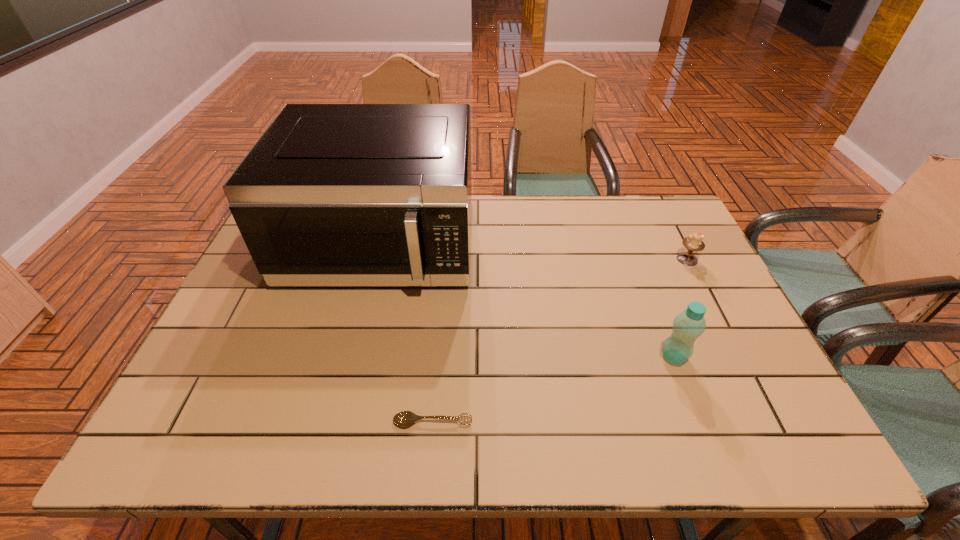
Find the location of a particular element. The image size is (960, 540). microwave_oven is located at coordinates (331, 194).

I want to click on the second nearest object, so pyautogui.click(x=688, y=325).

This screenshot has height=540, width=960. I want to click on the second tallest object, so click(x=688, y=325).

Find the location of a particular element. candle holder is located at coordinates (693, 242).

The image size is (960, 540). What are the coordinates of `the rightmost object` in the screenshot? It's located at (693, 242).

You are a GUI agent. You are given a task and a screenshot of the screen. Output one action in this format:
    pyautogui.click(x=<x>, y=<y>)
    Task: Click on the ladle
    Image resolution: width=960 pixels, height=540 pixels.
    Given the screenshot: What is the action you would take?
    pyautogui.click(x=404, y=418)

Find the location of a particular element. The width and height of the screenshot is (960, 540). the nearest object is located at coordinates (404, 418).

Locate an element on the screen. The image size is (960, 540). vacant space situated 0.150m on the front-facing side of the tallest object is located at coordinates click(x=355, y=348).

At what (x,y) coordinates should I click in order to perform the action: click on free location located on the back of the bottle. Please return your answer as a coordinate pair (x, y). Looking at the image, I should click on (643, 276).

At what (x,y) coordinates should I click in order to perform the action: click on free space located on the left of the third tallest object. Please return your answer as a coordinate pair (x, y). The height and width of the screenshot is (540, 960). Looking at the image, I should click on pos(605,259).